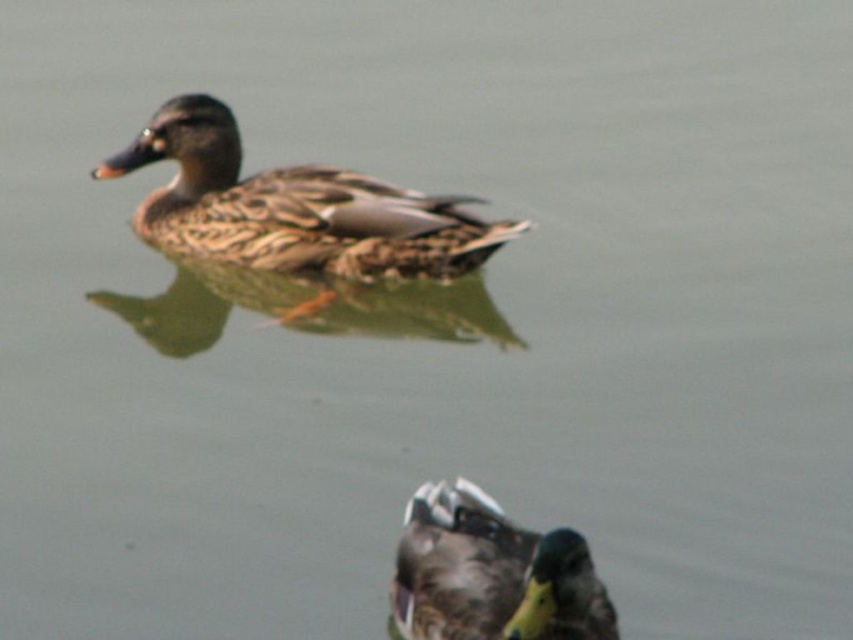
Does brown speckled feathers at upper center come behind brown speckled duck at center?

That is True.

Is point (164, 134) in front of point (407, 593)?

No.

The width and height of the screenshot is (853, 640). What are the coordinates of `brown speckled feathers at upper center` in the screenshot? It's located at (293, 209).